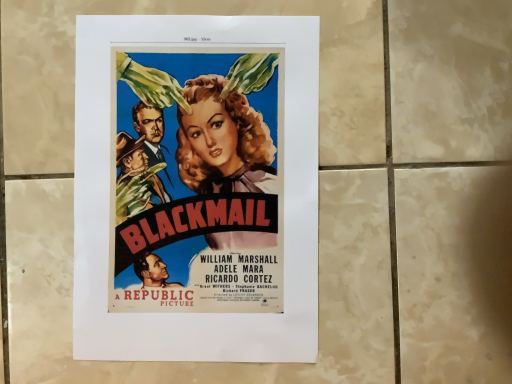
Image resolution: width=512 pixels, height=384 pixels. What do you see at coordinates (196, 188) in the screenshot? I see `matte paper poster at center` at bounding box center [196, 188].

Find the location of a particular element. The height and width of the screenshot is (384, 512). matte paper poster at center is located at coordinates (196, 188).

In order to click on matte paper poster at center in this screenshot , I will do `click(196, 188)`.